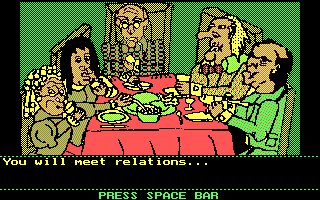
Locate an element on the screen. The image size is (320, 200). plate is located at coordinates (111, 116), (143, 84), (174, 89), (168, 110), (143, 97).